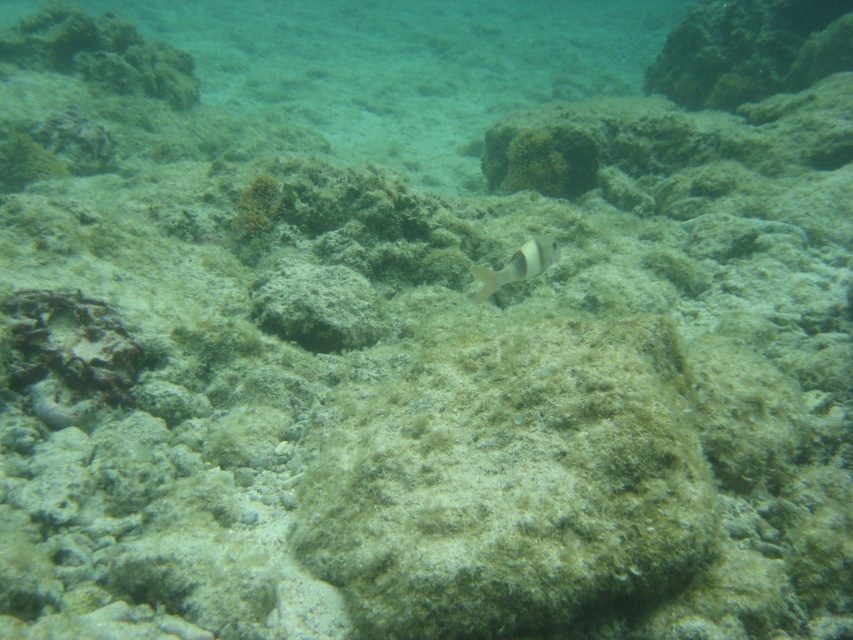
You are a scuba diver observing the underwater scene. You see a smooth gray rock at center and a white matte fish at center. Which object is positioned to the left of the other?

The smooth gray rock at center is to the left of the white matte fish at center.

You are a marine biologist studying underwater formations. You notice a smooth gray rock at center in the scene. Can you determine its exact position relative to the seabed?

The smooth gray rock at center is located at point (317, 305) on the seabed.